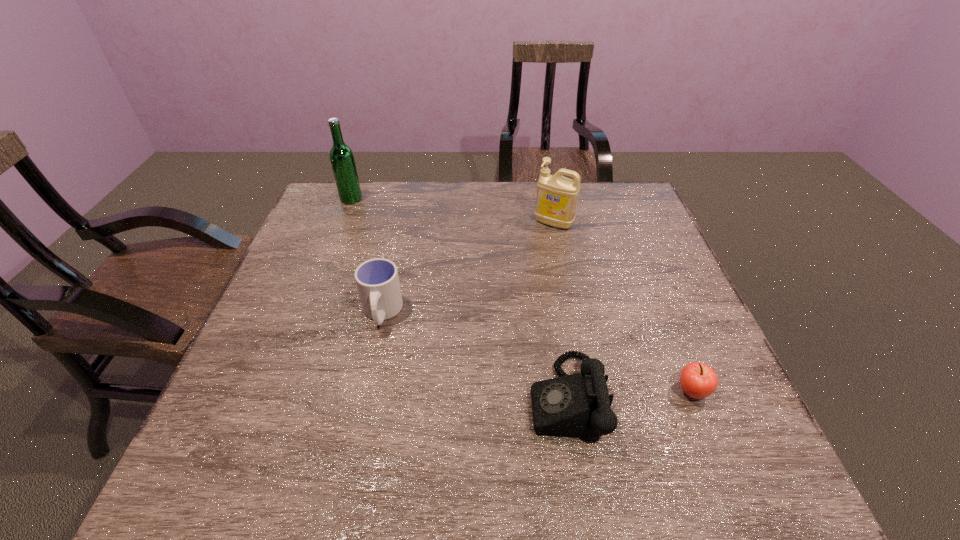
Where is `the second closest object to the fourth tallest object`? the second closest object to the fourth tallest object is located at coordinates (377, 280).

Where is `free space in the image that satisfies the following two spatial constraints: 1. on the front side of the detergent; 2. on the dial of the fourth tallest object`? free space in the image that satisfies the following two spatial constraints: 1. on the front side of the detergent; 2. on the dial of the fourth tallest object is located at coordinates (589, 398).